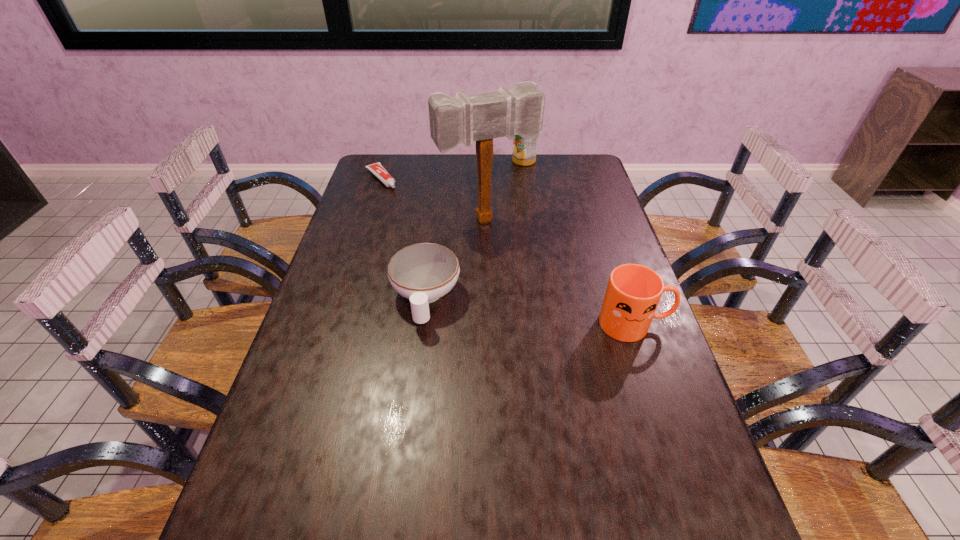
The width and height of the screenshot is (960, 540). Identify the location of chinaware. (424, 272).

At what (x,y) coordinates should I click in order to perform the action: click on the third tallest object. Please return your answer as a coordinate pair (x, y). Looking at the image, I should click on [x=633, y=292].

In order to click on the rightmost object in this screenshot , I will do `click(633, 292)`.

I want to click on the farthest object, so click(x=524, y=151).

Identify the location of the fourth shortest object. The height and width of the screenshot is (540, 960). (524, 151).

Find the location of a particular element. The image size is (960, 540). mallet is located at coordinates (462, 119).

You are a GUI agent. You are given a task and a screenshot of the screen. Output one action in this format:
    pyautogui.click(x=<x>, y=<y>)
    Task: Click on the third nearest object
    Image resolution: width=960 pixels, height=540 pixels.
    Given the screenshot: What is the action you would take?
    [462, 119]

Identify the location of the shortest object. (377, 169).

Where is `the fourth nearest object`? the fourth nearest object is located at coordinates (377, 169).

What are the coordinates of `vacant space situated on the side with the handle of the fourth tallest object` in the screenshot? It's located at (417, 372).